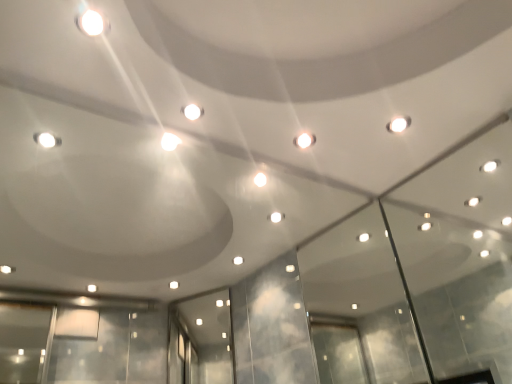
Identify the location of white glossy light at upper left. This screenshot has height=384, width=512. (91, 23).

The width and height of the screenshot is (512, 384). What do you see at coordinates (91, 23) in the screenshot?
I see `white glossy light at upper left` at bounding box center [91, 23].

This screenshot has height=384, width=512. In order to click on white glossy light at upper left in this screenshot , I will do `click(91, 23)`.